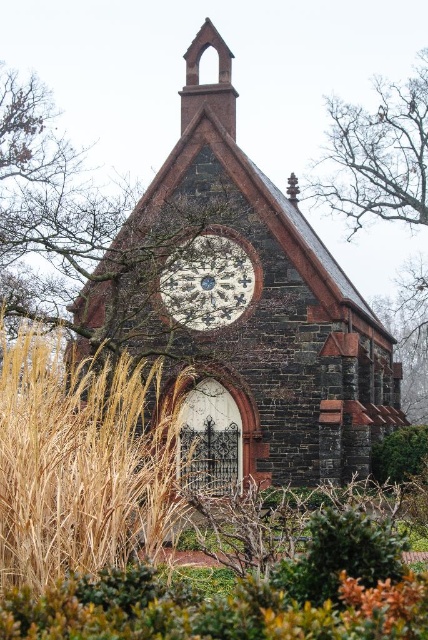
Question: Which point appears farthest from the camera in this image?

Choices:
 (A) (107, 317)
 (B) (359, 520)
 (C) (424, 436)
 (D) (222, 266)

Answer: (C)

Question: Which point is closer to the camera?

Choices:
 (A) green leafy bush at lower center
 (B) green leafy bush at lower right
 (C) dark brown stone chapel at center

Answer: (A)

Question: Is dark brown stone chapel at center bigger than white stone clock at center?

Choices:
 (A) no
 (B) yes

Answer: (B)

Question: Can you confirm if green leafy bush at lower center is positioned below green leafy bush at lower right?

Choices:
 (A) no
 (B) yes

Answer: (B)

Question: Is dark brown stone chapel at center thinner than bare branches at upper right?

Choices:
 (A) no
 (B) yes

Answer: (A)

Question: Which point appears closest to the camera in this image?

Choices:
 (A) (377, 180)
 (B) (210, 321)

Answer: (B)